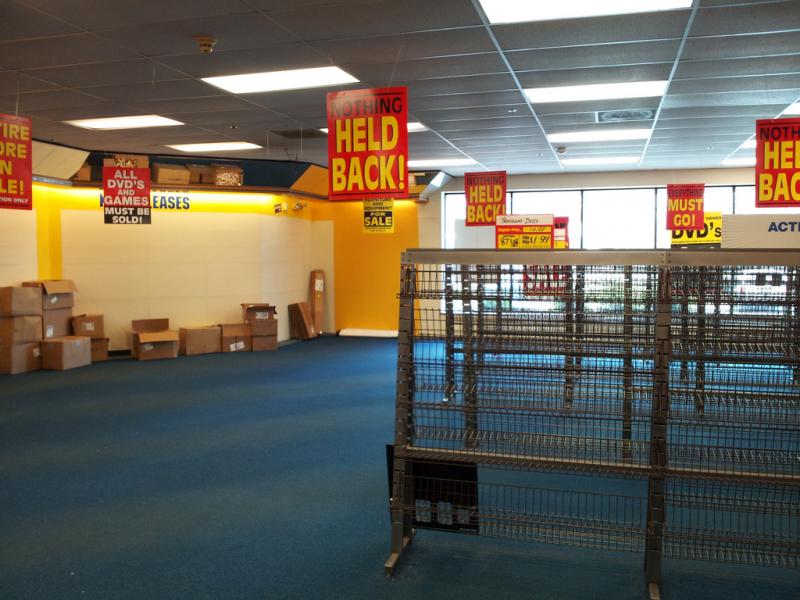
This screenshot has width=800, height=600. In order to click on cardboard boxes in this screenshot , I will do `click(50, 323)`, `click(162, 344)`, `click(264, 337)`, `click(316, 315)`.